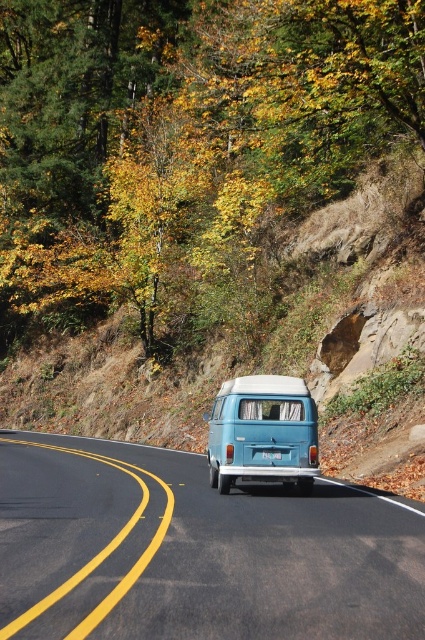
Question: Is yellow-green leaves at upper center wider than blue matte van at center?

Choices:
 (A) no
 (B) yes

Answer: (B)

Question: Is yellow-green leaves at upper center smaller than blue matte van at center?

Choices:
 (A) no
 (B) yes

Answer: (A)

Question: Is blue matte van at center wider than teal matte van at center?

Choices:
 (A) no
 (B) yes

Answer: (B)

Question: Among these points, which one is farthest from the camera?

Choices:
 (A) (112, 474)
 (B) (212, 433)

Answer: (A)

Question: Which point appears closest to the camera in this image?

Choices:
 (A) (258, 385)
 (B) (226, 508)

Answer: (B)

Question: Which point appears farthest from the camera in this image?

Choices:
 (A) (19, 508)
 (B) (206, 416)
 (C) (142, 288)

Answer: (C)